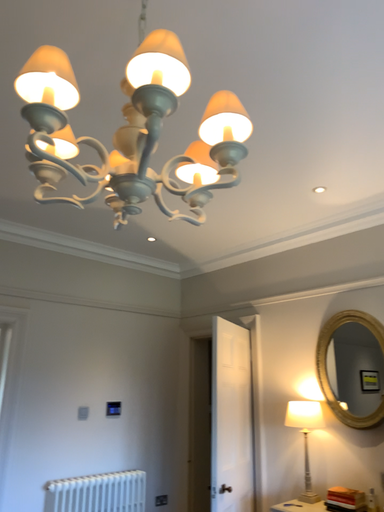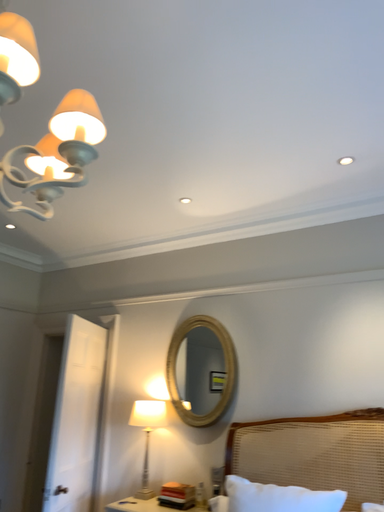
Question: How did the camera likely rotate when shooting the video?

Choices:
 (A) rotated right
 (B) rotated left

Answer: (A)